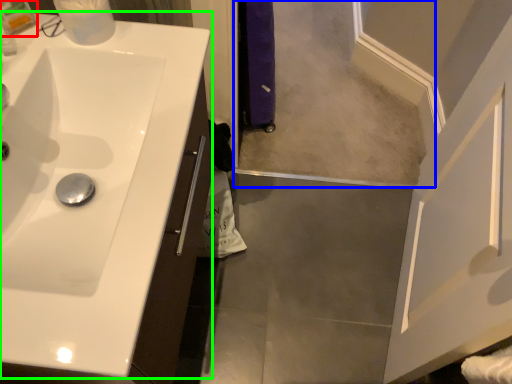
Question: Which is farther away from toiletry (highlighted by a red box)? mirror (highlighted by a blue box) or sink (highlighted by a green box)?

Choices:
 (A) mirror
 (B) sink

Answer: (A)